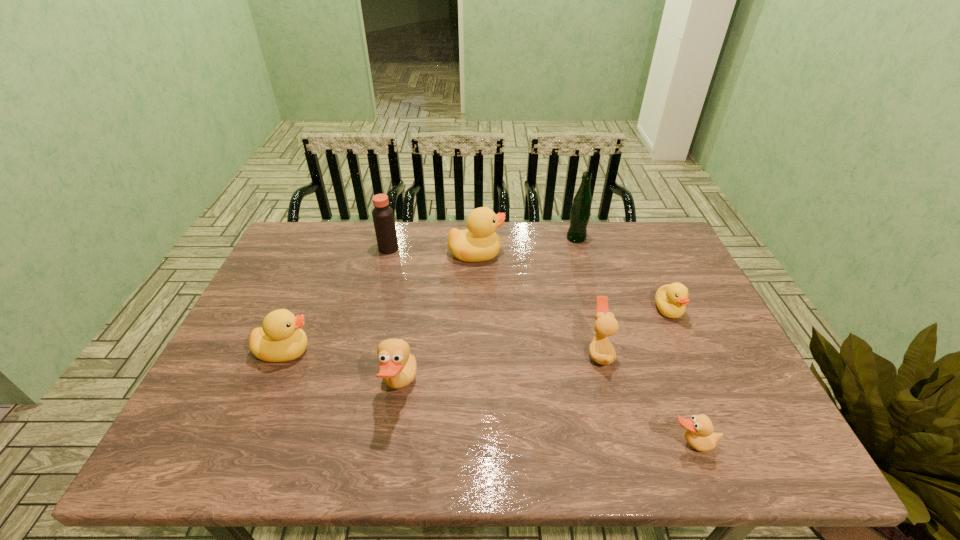
I want to click on the second tan duck from right to left, so click(x=601, y=350).

Identify the location of the second biggest tan duck. The width and height of the screenshot is (960, 540). (601, 350).

At what (x,y) coordinates should I click in order to perform the action: click on the rightmost yellow duck. Please return your answer as a coordinate pair (x, y). This screenshot has height=540, width=960. Looking at the image, I should click on (671, 299).

Where is `the fifth nearest object`? This screenshot has width=960, height=540. the fifth nearest object is located at coordinates (671, 299).

I want to click on the nearest duck, so click(x=699, y=433).

Find the location of a particular element. the smallest tan duck is located at coordinates (699, 433).

Find the location of a particular element. free spot located 0.370m on the left of the beer bottle is located at coordinates (457, 238).

Locate an element on the screen. This screenshot has height=540, width=960. free space located 0.180m on the right of the vinegar is located at coordinates (453, 249).

The width and height of the screenshot is (960, 540). I want to click on free space located 0.240m at the beak of the farthest yellow duck, so click(578, 254).

This screenshot has height=540, width=960. I want to click on free location located 0.110m on the beak of the biggest tan duck, so click(x=463, y=387).